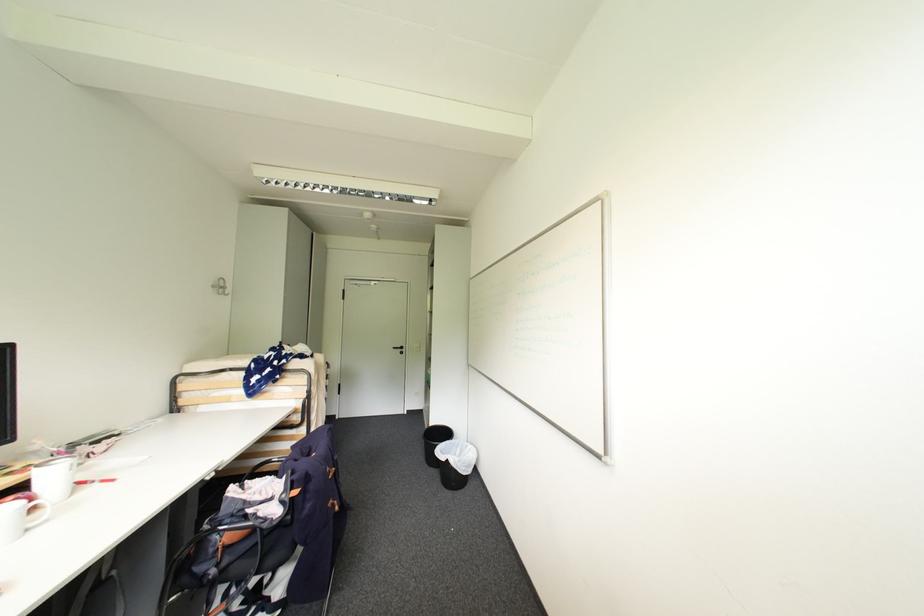
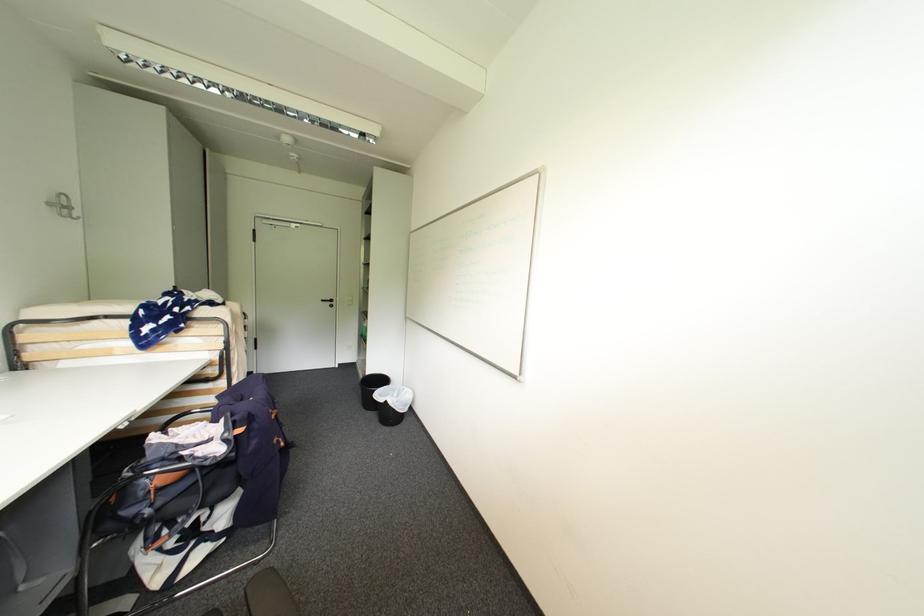
Question: The first image is from the beginning of the video and the second image is from the end. How did the camera likely rotate when shooting the video?

Choices:
 (A) Left
 (B) Right
 (C) Up
 (D) Down

Answer: (B)